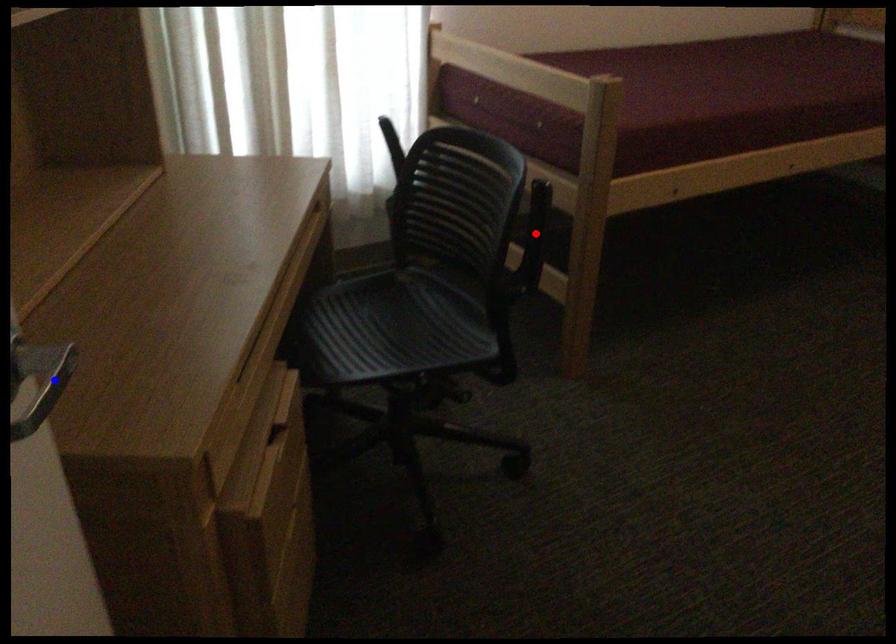
Question: Two points are marked on the image. Which point is closer to the camera?

Choices:
 (A) Blue point is closer.
 (B) Red point is closer.

Answer: (A)